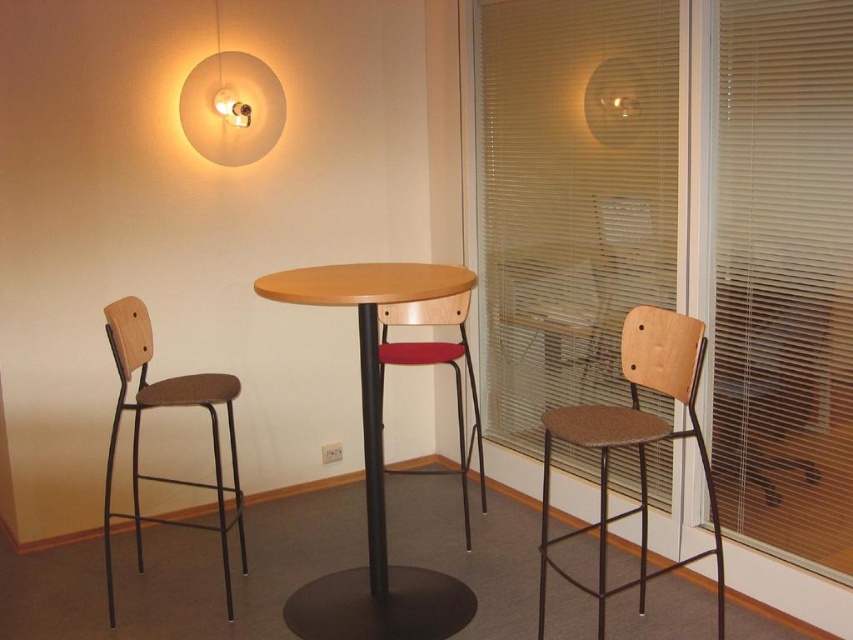
Which of these two, wooden bar stool at right or wooden seat at center, stands taller?

With more height is wooden bar stool at right.

The width and height of the screenshot is (853, 640). I want to click on wooden bar stool at right, so click(634, 444).

Where is `wooden bar stool at right`? wooden bar stool at right is located at coordinates (634, 444).

Is transparent plastic blinds at right bigger than brown matte stool at left?

Correct, transparent plastic blinds at right is larger in size than brown matte stool at left.

Does transparent plastic blinds at right appear on the left side of brown matte stool at left?

In fact, transparent plastic blinds at right is to the right of brown matte stool at left.

Between point (555, 208) and point (183, 404), which one is positioned behind?

Positioned behind is point (555, 208).

The width and height of the screenshot is (853, 640). Identify the location of transparent plastic blinds at right. (782, 276).

From the picture: Who is more forward, (769,188) or (418,636)?

Point (769,188) is in front.

What do you see at coordinates (782, 276) in the screenshot? I see `transparent plastic blinds at right` at bounding box center [782, 276].

Does point (618, 205) lie in front of point (300, 621)?

No, it is not.

What are the coordinates of `transparent plastic blinds at right` in the screenshot? It's located at [x=782, y=276].